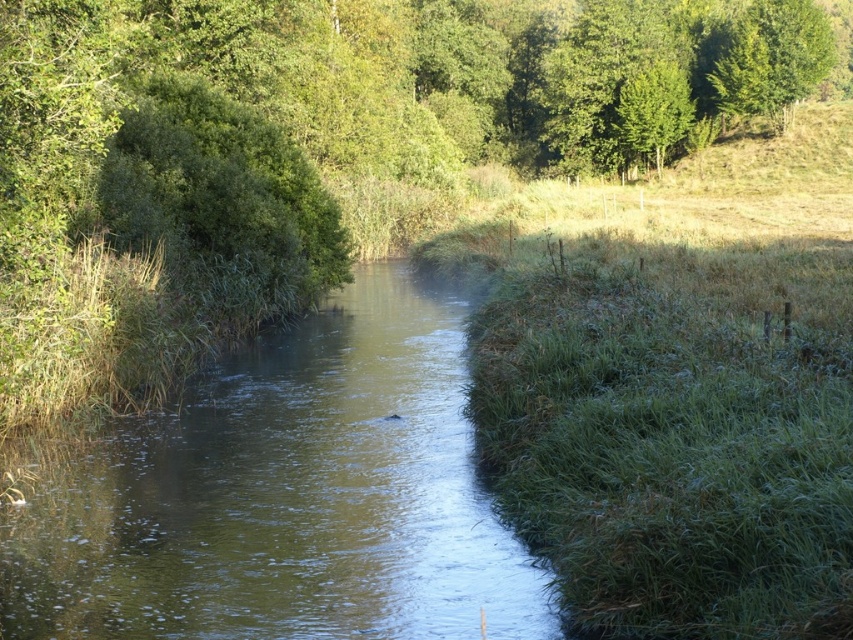
Question: Which object appears closest to the camera in this image?

Choices:
 (A) green grassy bank at center-right
 (B) green grassy stream at center

Answer: (A)

Question: Which of the following is the farthest from the observer?

Choices:
 (A) green grassy stream at center
 (B) green grassy bank at center-right

Answer: (A)

Question: Which point is farther to the camera?

Choices:
 (A) green grassy bank at center-right
 (B) green grassy stream at center

Answer: (B)

Question: Considering the relative positions of green grassy bank at center-right and green grassy stream at center in the image provided, where is green grassy bank at center-right located with respect to green grassy stream at center?

Choices:
 (A) above
 (B) below

Answer: (A)

Question: Is green grassy bank at center-right to the left of green grassy stream at center from the viewer's perspective?

Choices:
 (A) yes
 (B) no

Answer: (B)

Question: Can you confirm if green grassy bank at center-right is positioned above green grassy stream at center?

Choices:
 (A) yes
 (B) no

Answer: (A)